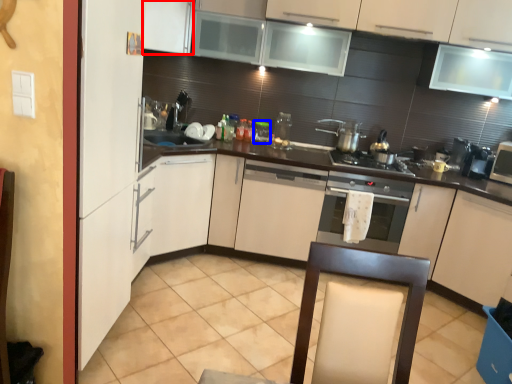
Question: Among these objects, which one is nearest to the camera, cabinetry (highlighted by a red box) or appliance (highlighted by a blue box)?

Choices:
 (A) cabinetry
 (B) appliance

Answer: (A)